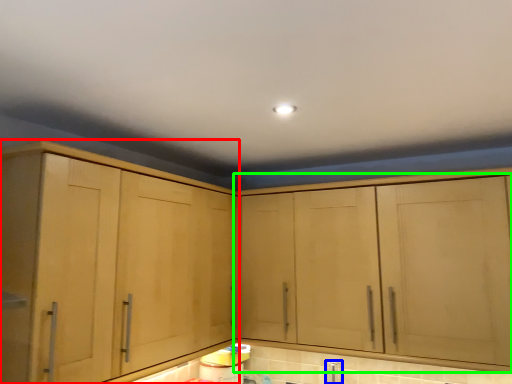
Question: Considering the real-world distances, which object is closest to cabinetry (highlighted by a red box)? faucet (highlighted by a blue box) or cabinetry (highlighted by a green box).

Choices:
 (A) faucet
 (B) cabinetry

Answer: (B)